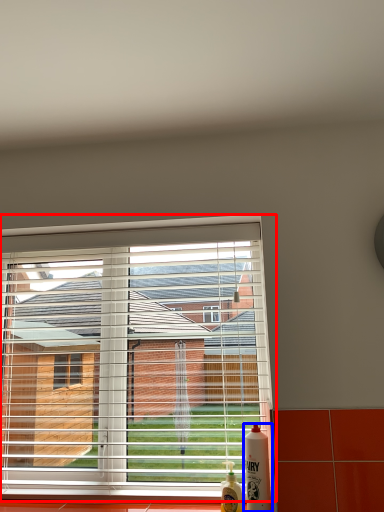
Question: Which object is closer to the camera taking this photo, window (highlighted by a red box) or bottle (highlighted by a blue box)?

Choices:
 (A) window
 (B) bottle

Answer: (B)